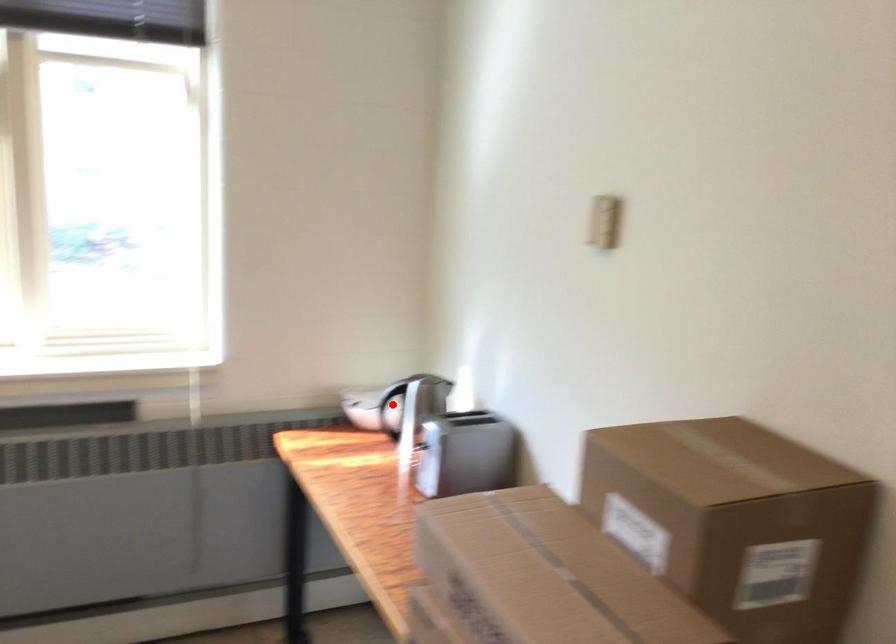
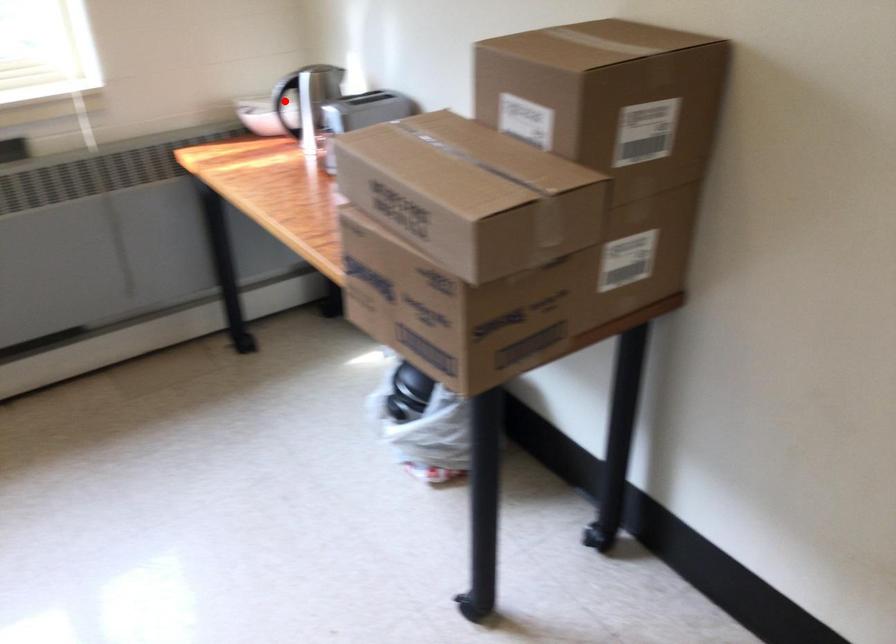
I am providing you with two images of the same scene from different viewpoints. A red point is marked on the first image and another point is marked on the second image. Is the red point in image1 aligned with the point shown in image2?

Yes